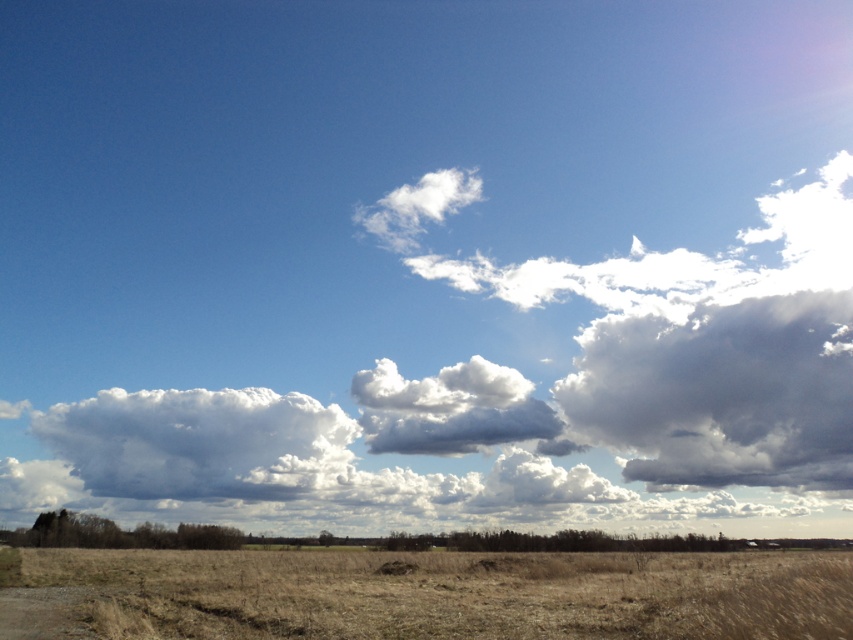
Question: Among these points, which one is nearest to the camera?

Choices:
 (A) (590, 268)
 (B) (682, 586)
 (C) (848, 461)

Answer: (B)

Question: Is white fluffy cloud at upper center wider than cloudy gray at upper right?

Choices:
 (A) yes
 (B) no

Answer: (A)

Question: Where is brown grassland at lower center located in relation to brown dirt track at lower left in the image?

Choices:
 (A) below
 (B) above

Answer: (A)

Question: Considering the relative positions of cloudy gray at upper right and white fluffy cloud at center in the image provided, where is cloudy gray at upper right located with respect to white fluffy cloud at center?

Choices:
 (A) right
 (B) left

Answer: (A)

Question: Which point is farther from the camera taking this photo?

Choices:
 (A) (770, 420)
 (B) (293, 451)
 (C) (107, 593)

Answer: (A)

Question: Which of the following is the closest to the observer?

Choices:
 (A) cloudy gray at upper right
 (B) brown grassland at lower center
 (C) brown dirt track at lower left

Answer: (B)